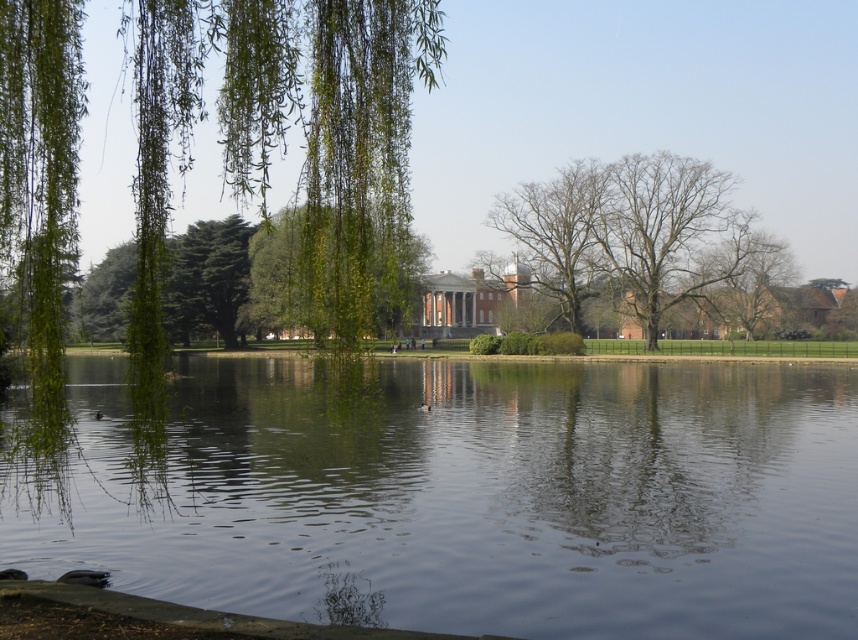
Question: Considering the real-world distances, which object is farthest from the green leafy willow at left?

Choices:
 (A) bare branches at center
 (B) transparent water at center

Answer: (A)

Question: Which point appears farthest from the camera in this image?

Choices:
 (A) (563, 301)
 (B) (180, 112)
 (C) (578, 298)

Answer: (A)

Question: Is green leafy willow at left thinner than bare branches at center?

Choices:
 (A) yes
 (B) no

Answer: (B)

Question: Can you confirm if bare wood tree at center is positioned below bare branches at center?

Choices:
 (A) no
 (B) yes

Answer: (B)

Question: Based on their relative distances, which object is farther from the bare wood tree at center?

Choices:
 (A) transparent water at center
 (B) green leafy willow at left

Answer: (B)

Question: Observing the image, what is the correct spatial positioning of transparent water at center in reference to bare wood tree at center?

Choices:
 (A) below
 (B) above

Answer: (A)